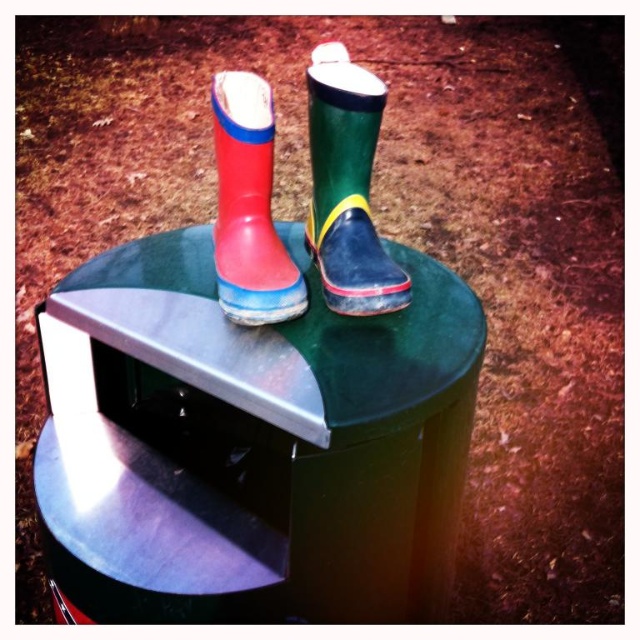
Question: Is green rubber stool at center positioned behind green rubber boot at upper center?

Choices:
 (A) no
 (B) yes

Answer: (A)

Question: Which object is positioned farthest from the green rubber boot at upper center?

Choices:
 (A) green rubber stool at center
 (B) rubber/matte rain boot at upper center

Answer: (A)

Question: Is green rubber boot at upper center positioned before rubber/matte rain boot at upper center?

Choices:
 (A) no
 (B) yes

Answer: (A)

Question: Is green rubber stool at center smaller than green rubber boot at upper center?

Choices:
 (A) no
 (B) yes

Answer: (A)

Question: Which point is closer to the camera taking this photo?

Choices:
 (A) (301, 304)
 (B) (122, 296)
 (C) (310, 212)

Answer: (A)

Question: Which of the following is the closest to the observer?

Choices:
 (A) (225, 189)
 (B) (317, 589)
 (C) (321, 172)

Answer: (B)